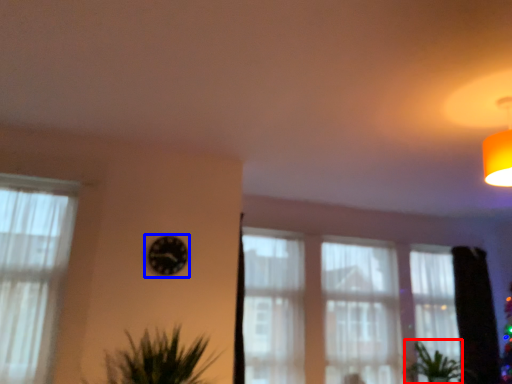
Question: Among these objects, which one is nearest to the camera, plant (highlighted by a red box) or clock (highlighted by a blue box)?

Choices:
 (A) plant
 (B) clock

Answer: (B)